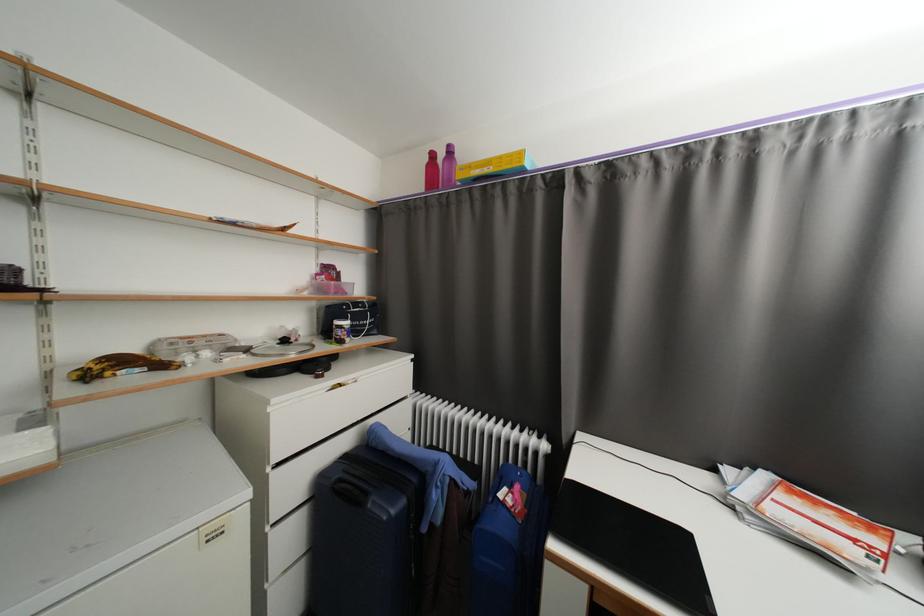
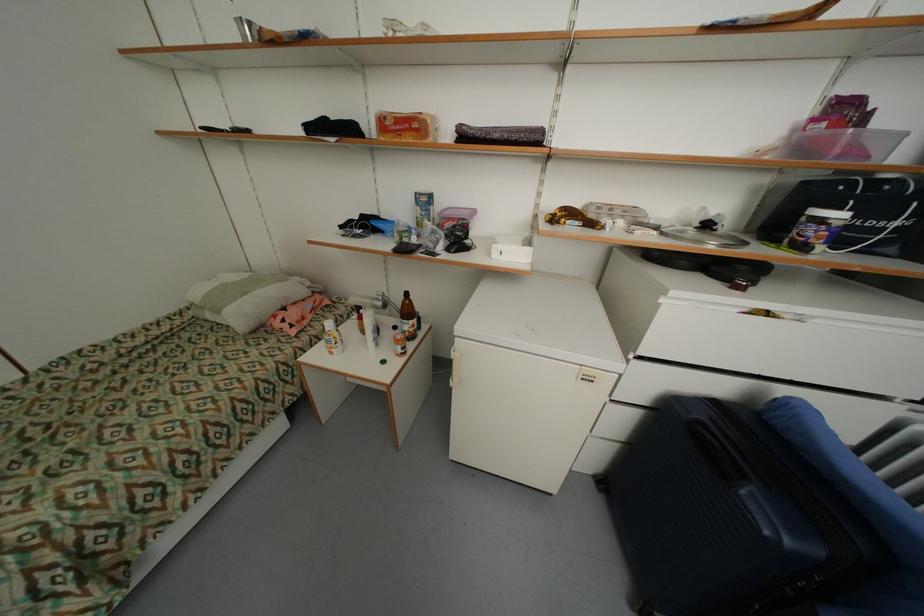
First-person continuous shooting, in which direction is the camera rotating?

The camera's rotation is toward left-down.